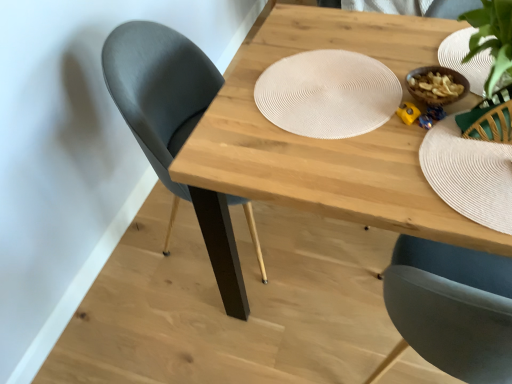
At what (x,y) coordinates should I click in order to perform the action: click on white textured paper plate at upper right. Please return your answer as a coordinate pair (x, y). This screenshot has width=512, height=384. Looking at the image, I should click on (463, 57).

Describe the element at coordinates (328, 94) in the screenshot. I see `white woven placemat at center` at that location.

Describe the element at coordinates (159, 92) in the screenshot. I see `matte black chair at left` at that location.

Where is `white textured paper plate at upper right`? This screenshot has width=512, height=384. white textured paper plate at upper right is located at coordinates (463, 57).

Are white woven placemat at center and matte black chair at left far apart?

No, there isn't a large distance between white woven placemat at center and matte black chair at left.

From the image's perspective, who appears lower, white woven placemat at center or matte black chair at left?

matte black chair at left appears lower in the image.

Considering their positions, is white woven placemat at center located in front of or behind matte black chair at left?

white woven placemat at center is in front of matte black chair at left.

Considering the relative positions of white woven placemat at center and white textured paper plate at upper right in the image provided, is white woven placemat at center to the left of white textured paper plate at upper right from the viewer's perspective?

Yes, white woven placemat at center is to the left of white textured paper plate at upper right.

Does white woven placemat at center contain white textured paper plate at upper right?

No, white woven placemat at center does not contain white textured paper plate at upper right.

From a real-world perspective, is white woven placemat at center over white textured paper plate at upper right?

Yes, from a real-world perspective, white woven placemat at center is above white textured paper plate at upper right.

In the scene shown: Considering the sizes of objects matte black chair at left and white textured paper plate at upper right in the image provided, who is smaller, matte black chair at left or white textured paper plate at upper right?

white textured paper plate at upper right is smaller.

From a real-world perspective, is matte black chair at left located beneath white textured paper plate at upper right?

Yes.

Looking at their sizes, would you say matte black chair at left is wider or thinner than white textured paper plate at upper right?

Considering their sizes, matte black chair at left looks broader than white textured paper plate at upper right.

Is matte black chair at left positioned before white woven placemat at center?

No, the depth of matte black chair at left is greater than that of white woven placemat at center.

Which object is thinner, matte black chair at left or white woven placemat at center?

white woven placemat at center is thinner.

Find the location of a particular element. The width and height of the screenshot is (512, 384). chair below the white woven placemat at center (from a real-world perspective) is located at coordinates (159, 92).

Can you tell me how much matte black chair at left and white woven placemat at center differ in facing direction?

matte black chair at left and white woven placemat at center are facing 91.3 degrees away from each other.

From the image's perspective, is natural wood table at center on top of matte black chair at left?

No, from the image's perspective, natural wood table at center is not over matte black chair at left.

From a real-world perspective, is natural wood table at center positioned above or below matte black chair at left?

natural wood table at center is situated lower than matte black chair at left in the real world.

Does point (307, 28) lie in front of point (109, 42)?

That is False.

The height and width of the screenshot is (384, 512). In order to click on chair above the natural wood table at center (from a real-world perspective) in this screenshot , I will do `click(159, 92)`.

From the image's perspective, is natural wood table at center below white woven placemat at center?

Indeed, from the image's perspective, natural wood table at center is shown beneath white woven placemat at center.

Measure the distance between natural wood table at center and white woven placemat at center.

They are 5.40 inches apart.

Is natural wood table at center aimed at white woven placemat at center?

No, natural wood table at center is not turned towards white woven placemat at center.

Which of these two, natural wood table at center or white woven placemat at center, is wider?

With larger width is natural wood table at center.

From the image's perspective, which is above, white textured paper plate at upper right or white woven placemat at center?

white textured paper plate at upper right is shown above in the image.

Does point (470, 27) come behind point (360, 88)?

Yes, it is behind point (360, 88).

How much distance is there between white textured paper plate at upper right and white woven placemat at center?

The distance of white textured paper plate at upper right from white woven placemat at center is 12.65 inches.

Is the depth of white textured paper plate at upper right less than that of white woven placemat at center?

No.

This screenshot has width=512, height=384. I want to click on platter on the right of matte black chair at left, so 328,94.

Where is `paper plate that is above the white woven placemat at center (from the image's perspective)`? The height and width of the screenshot is (384, 512). paper plate that is above the white woven placemat at center (from the image's perspective) is located at coordinates coord(463,57).

When comparing their distances from white woven placemat at center, does matte black chair at left or white textured paper plate at upper right seem closer?

The object closer to white woven placemat at center is white textured paper plate at upper right.

Consider the image. Looking at the image, which one is located further to natural wood table at center, white textured paper plate at upper right or white woven placemat at center?

white textured paper plate at upper right.

Considering their positions, is white woven placemat at center positioned further to matte black chair at left than white textured paper plate at upper right?

white textured paper plate at upper right lies further to matte black chair at left than the other object.

Which object lies further to the anchor point matte black chair at left, natural wood table at center or white textured paper plate at upper right?

white textured paper plate at upper right is further to matte black chair at left.

Which object lies nearer to the anchor point white textured paper plate at upper right, matte black chair at left or natural wood table at center?

natural wood table at center is positioned closer to the anchor white textured paper plate at upper right.

Considering their positions, is natural wood table at center positioned closer to white woven placemat at center than matte black chair at left?

natural wood table at center lies closer to white woven placemat at center than the other object.

Considering their positions, is matte black chair at left positioned closer to white textured paper plate at upper right than white woven placemat at center?

white woven placemat at center.

Estimate the real-world distances between objects in this image. Which object is closer to natural wood table at center, matte black chair at left or white textured paper plate at upper right?

Among the two, matte black chair at left is located nearer to natural wood table at center.

Find the location of `table between matte black chair at left and white textured paper plate at upper right from left to right`. table between matte black chair at left and white textured paper plate at upper right from left to right is located at coordinates (318, 145).

Identify the location of table between white woven placemat at center and white textured paper plate at upper right. pos(318,145).

You are a GUI agent. You are given a task and a screenshot of the screen. Output one action in this format:
    pyautogui.click(x=<x>, y=<y>)
    Task: Click on the platter between matte black chair at left and natural wood table at center
    This screenshot has width=512, height=384.
    Given the screenshot: What is the action you would take?
    pyautogui.click(x=328, y=94)

Identify the location of platter located between matte black chair at left and white textured paper plate at upper right in the left-right direction. This screenshot has height=384, width=512. (328, 94).